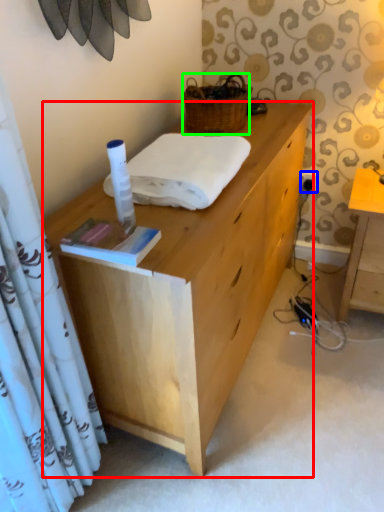
Question: Based on their relative distances, which object is nearer to desk (highlighted by a red box)? Choose from power outlet (highlighted by a blue box) and picnic basket (highlighted by a green box).

Choices:
 (A) power outlet
 (B) picnic basket

Answer: (B)